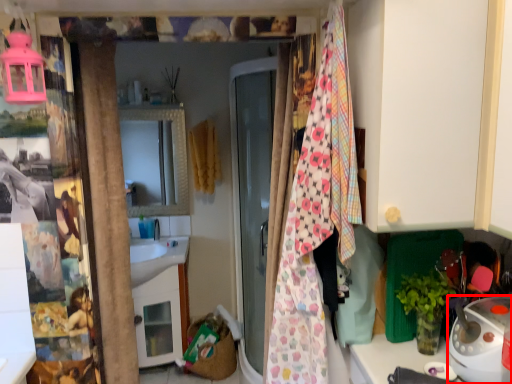
Question: From the image, what is the correct spatial relationship of appliance (annotated by the red box) in relation to blanket?

Choices:
 (A) right
 (B) left

Answer: (A)